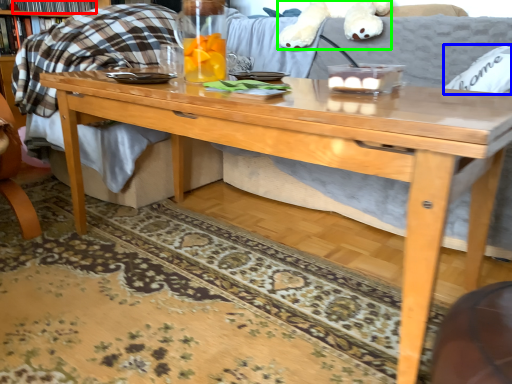
Question: Based on their relative distances, which object is farther from book (highlighted by a red box)? Choose from pillow (highlighted by a blue box) and animal (highlighted by a green box).

Choices:
 (A) pillow
 (B) animal

Answer: (A)